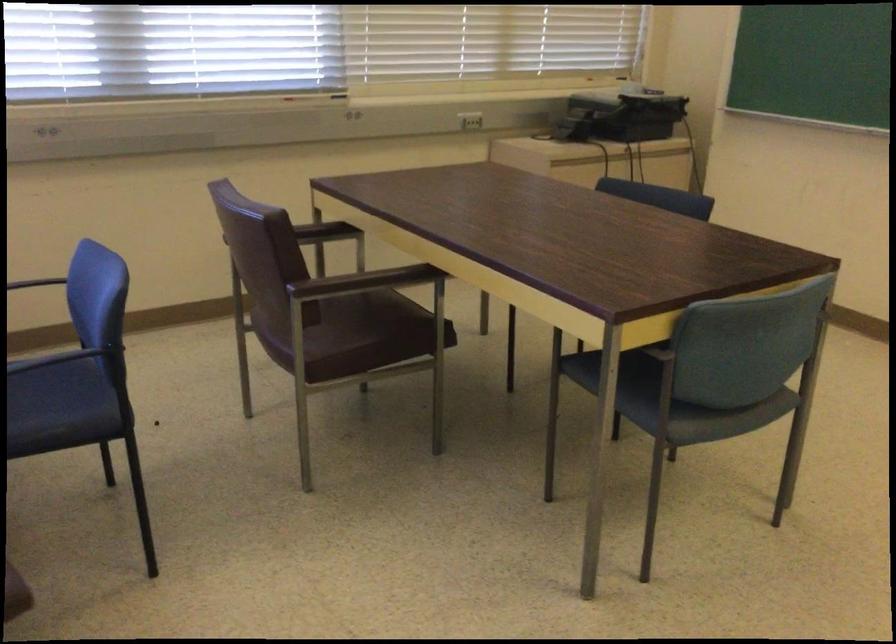
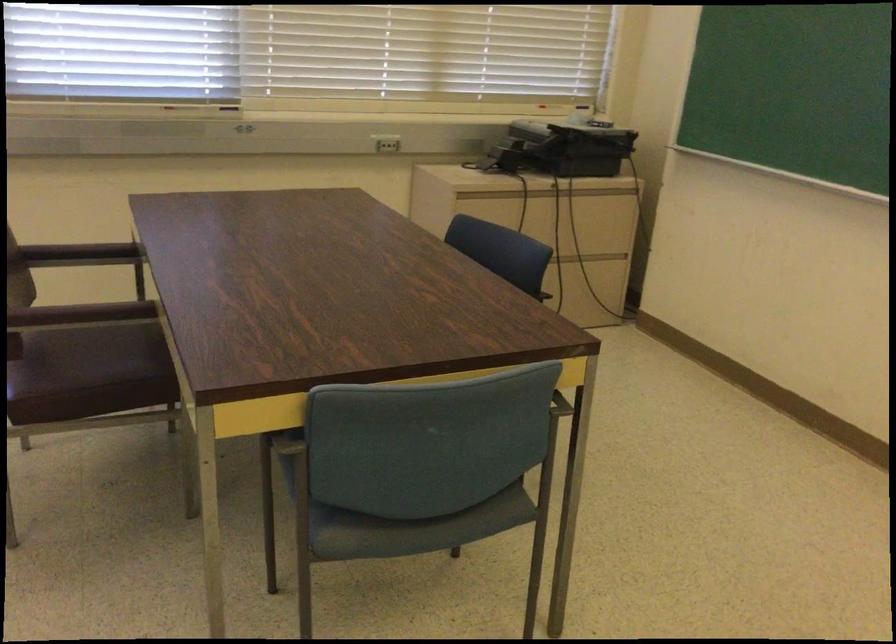
Question: The camera is either moving clockwise (left) or counter-clockwise (right) around the object. The first image is from the beginning of the video and the second image is from the end. Is the camera moving left or right when shooting the video?

Choices:
 (A) Left
 (B) Right

Answer: (B)